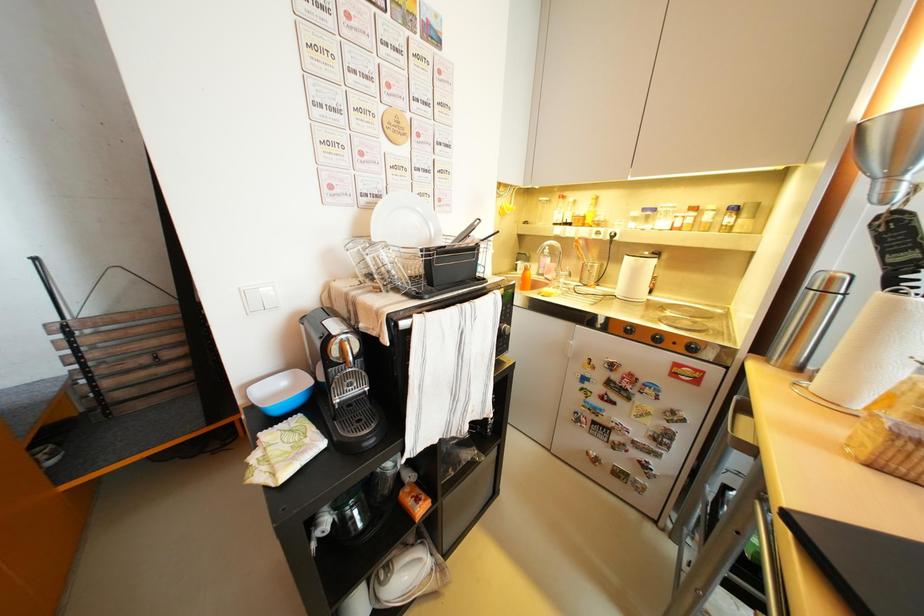
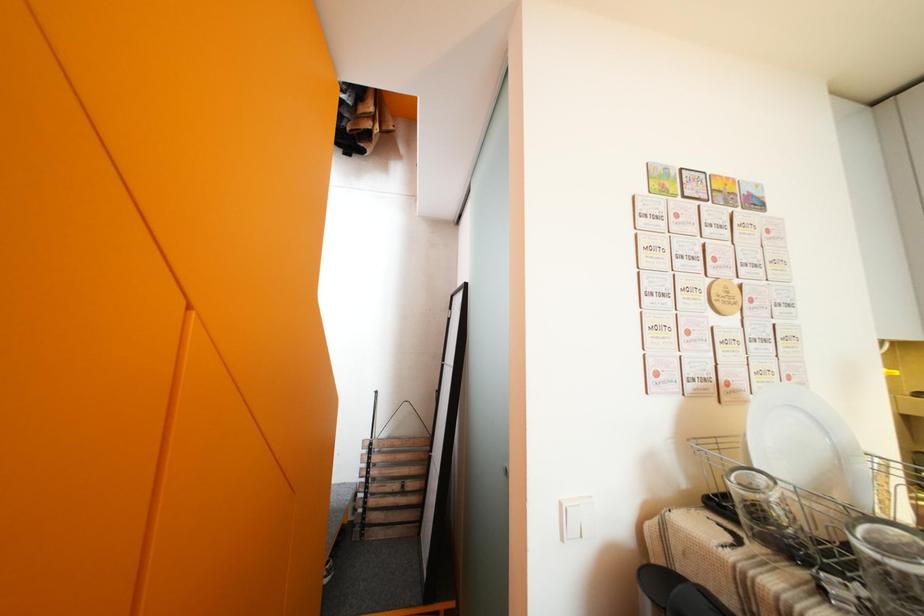
Based on the continuous images, in which direction is the camera rotating?

The camera's rotation is toward left-up.